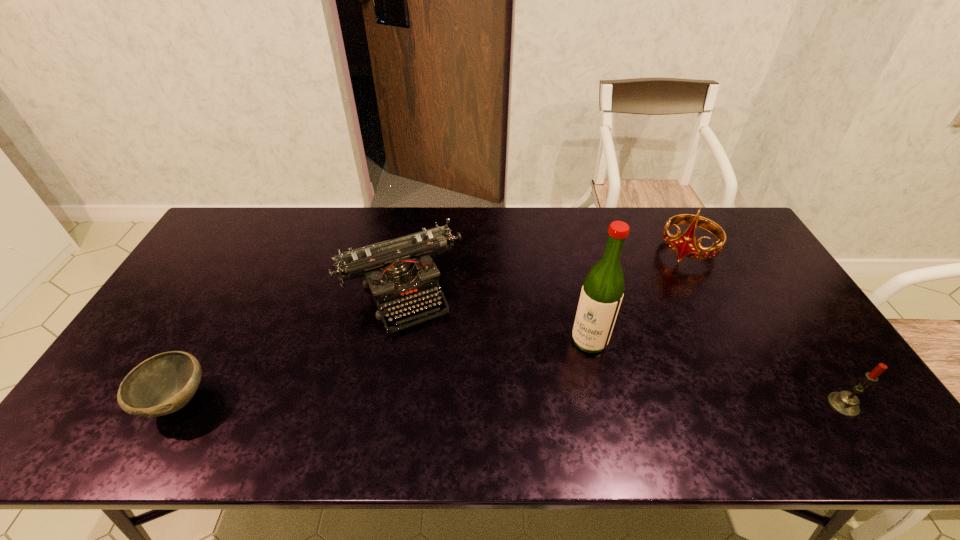
At what (x,y) coordinates should I click in order to perform the action: click on bowl. Please return your answer as a coordinate pair (x, y). The width and height of the screenshot is (960, 540). Looking at the image, I should click on (163, 384).

Identify the location of the leftmost object. The width and height of the screenshot is (960, 540). (163, 384).

What are the coordinates of `candle` in the screenshot? It's located at (845, 403).

Find the location of `typewriter`. typewriter is located at coordinates (399, 272).

The height and width of the screenshot is (540, 960). Find the location of `the fourth object from left to right`. the fourth object from left to right is located at coordinates (685, 245).

The height and width of the screenshot is (540, 960). Identify the location of the fourth shortest object. (685, 245).

Identify the location of the tallest object. The width and height of the screenshot is (960, 540). (602, 292).

Where is `the third object from left to right`? The height and width of the screenshot is (540, 960). the third object from left to right is located at coordinates (602, 292).

Locate an element on the screen. The image size is (960, 540). blank area located 0.070m on the back of the leftmost object is located at coordinates (205, 350).

At what (x,y) coordinates should I click in order to perform the action: click on free space located 0.110m on the left of the rightmost object. Please return your answer as a coordinate pair (x, y). The height and width of the screenshot is (540, 960). Looking at the image, I should click on (783, 405).